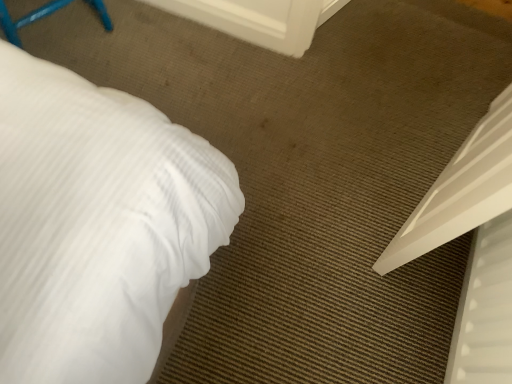
Question: Considering the positions of white plastic screen door at upper center and white plastic bed at lower right in the image, is white plastic screen door at upper center bigger or smaller than white plastic bed at lower right?

Choices:
 (A) big
 (B) small

Answer: (B)

Question: Is white plastic screen door at upper center to the left or to the right of white plastic bed at lower right in the image?

Choices:
 (A) right
 (B) left

Answer: (B)

Question: In terms of height, does white plastic screen door at upper center look taller or shorter compared to white plastic bed at lower right?

Choices:
 (A) tall
 (B) short

Answer: (B)

Question: From a real-world perspective, is white plastic bed at lower right positioned above or below white plastic screen door at upper center?

Choices:
 (A) above
 (B) below

Answer: (A)

Question: In terms of width, does white plastic bed at lower right look wider or thinner when compared to white plastic screen door at upper center?

Choices:
 (A) wide
 (B) thin

Answer: (A)

Question: Visually, is white plastic bed at lower right positioned to the left or to the right of white plastic screen door at upper center?

Choices:
 (A) left
 (B) right

Answer: (B)

Question: Is point (453, 370) closer or farther from the camera than point (158, 1)?

Choices:
 (A) farther
 (B) closer

Answer: (B)